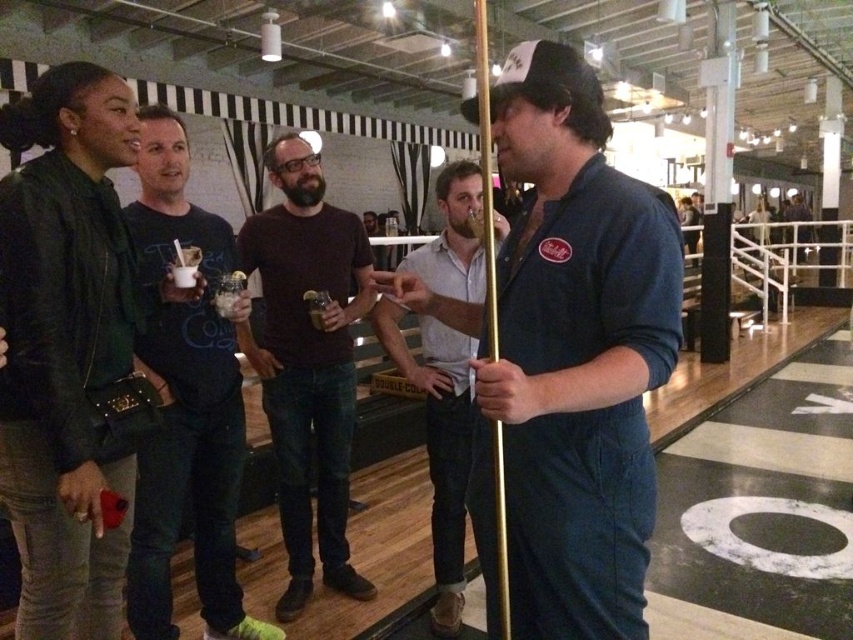
Question: Does dark blue t-shirt at center have a larger size compared to brown cotton shirt at center?

Choices:
 (A) no
 (B) yes

Answer: (A)

Question: Estimate the real-world distances between objects in this image. Which object is closer to the brown cotton shirt at center?

Choices:
 (A) denim jumpsuit at center
 (B) leather jacket at left
 (C) light gray cotton shirt at center
 (D) dark blue t-shirt at center

Answer: (D)

Question: From the image, what is the correct spatial relationship of dark blue t-shirt at center in relation to light gray cotton shirt at center?

Choices:
 (A) left
 (B) right

Answer: (A)

Question: Is denim jumpsuit at center positioned in front of dark blue t-shirt at center?

Choices:
 (A) no
 (B) yes

Answer: (B)

Question: Which point is closer to the camera?

Choices:
 (A) (50, 563)
 (B) (277, 236)
 (C) (143, 248)

Answer: (A)

Question: Which object is positioned farthest from the leather jacket at left?

Choices:
 (A) denim jumpsuit at center
 (B) brown cotton shirt at center
 (C) light gray cotton shirt at center

Answer: (A)